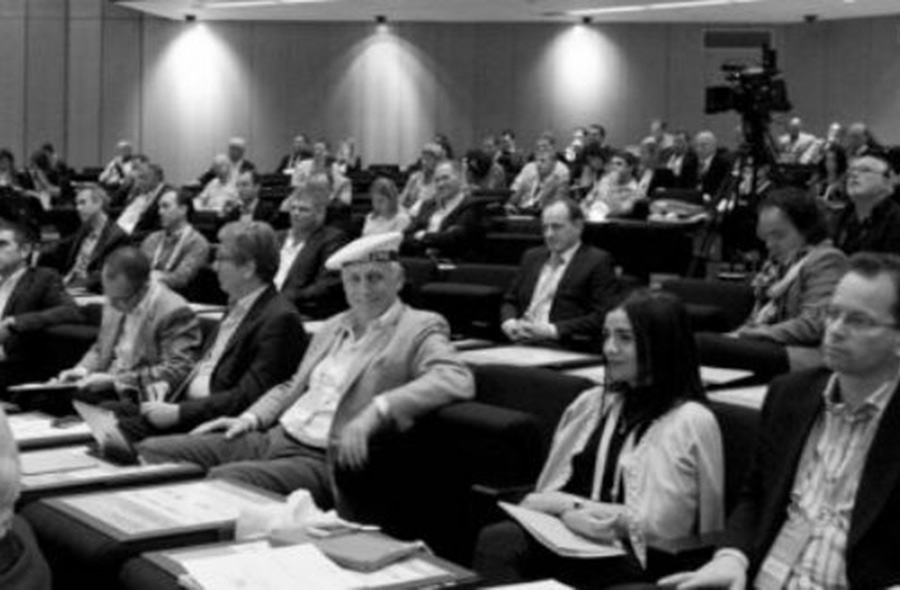
The height and width of the screenshot is (590, 900). In order to click on 1 black and white photo in this screenshot , I will do `click(385, 136)`.